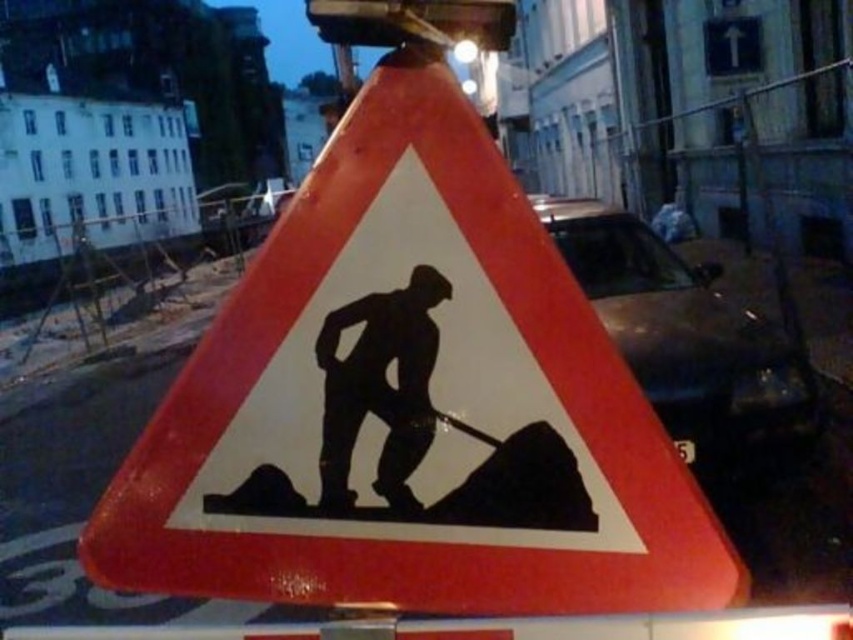
Question: Which point appears closest to the camera in this image?

Choices:
 (A) (596, 394)
 (B) (381, 369)

Answer: (A)

Question: Which point is closer to the camera?

Choices:
 (A) reflective plastic construction sign at center
 (B) black silhouette at center

Answer: (A)

Question: Is reflective plastic construction sign at center smaller than black silhouette at center?

Choices:
 (A) yes
 (B) no

Answer: (B)

Question: Does reflective plastic construction sign at center have a lesser width compared to black silhouette at center?

Choices:
 (A) yes
 (B) no

Answer: (B)

Question: Does reflective plastic construction sign at center come behind black silhouette at center?

Choices:
 (A) yes
 (B) no

Answer: (B)